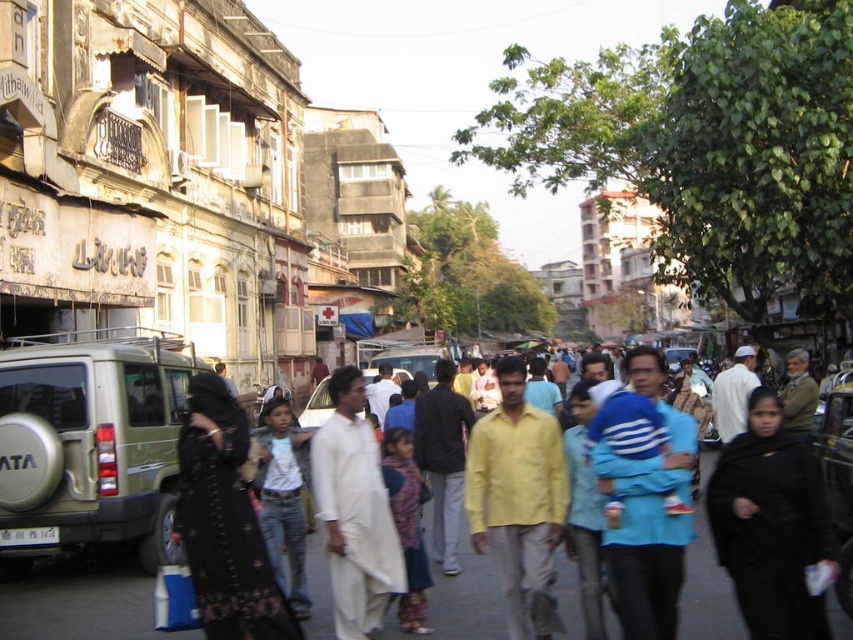
Based on the photo, you are a delivery person needing to cross the street to reach the matte gold suv at left. The crosswalk is 45 meters away. Can you safely reach the crosswalk before the traffic light turns red?

The crosswalk is 45 meters away, and the matte gold suv at left is 47.40 meters away from you. Since the crosswalk is closer, you can safely reach it before the traffic light turns red.

You are a photographer trying to capture both the black textured dress at center and the white cotton kurta at center in a single frame. Which clothing item requires more space to avoid being cut off?

The black textured dress at center requires more space because its width is larger than the white cotton kurta at center, so it needs more room to fit entirely in the frame.

You are a pedestrian trying to cross the street and see the matte gold suv at left and the white cotton kurta at center. Which object is closer to you?

The white cotton kurta at center is behind the matte gold suv at left, so the matte gold suv at left is closer to you.